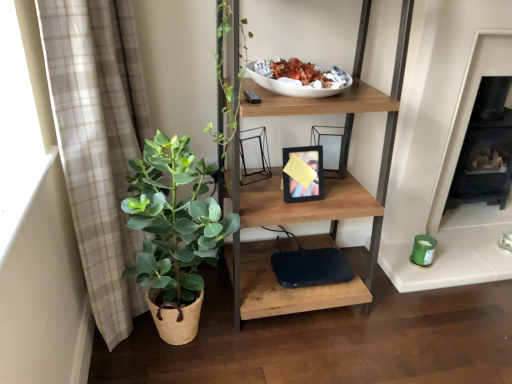
This screenshot has width=512, height=384. Find the location of `vacant space to the right of wooden shelf at center`. vacant space to the right of wooden shelf at center is located at coordinates (415, 323).